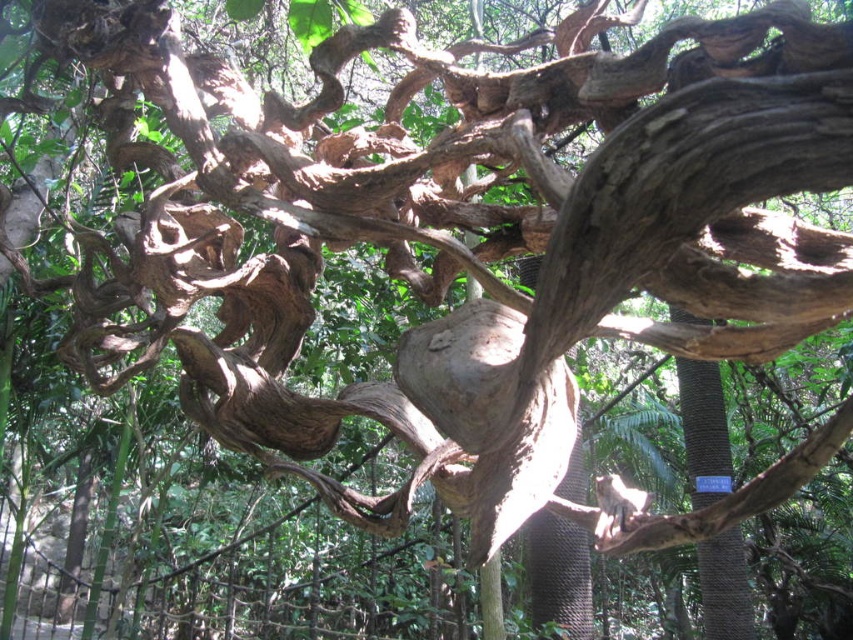
Based on the photo, you are a botanist examining the tree. You notice two parts of the tree at the center. One is labeled as smooth brown bark at center and the other as brown rough textured tree trunk at center. Which part has a greater width?

The smooth brown bark at center might be wider than brown rough textured tree trunk at center according to the description.